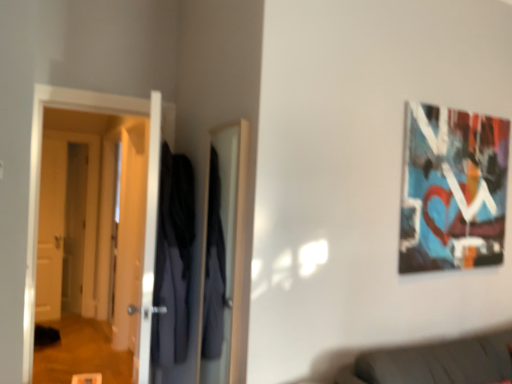
Question: From the image's perspective, relative to white wooden door at left, which is the third door in front-to-back order, is white glossy door at left, acting as the 3th door starting from the back, above or below?

Choices:
 (A) above
 (B) below

Answer: (A)

Question: Is white glossy door at left, acting as the 3th door starting from the back, inside or outside of white wooden door at left, which is the second door from right to left?

Choices:
 (A) outside
 (B) inside

Answer: (A)

Question: Which is farther from the white glossy door at left, marked as the 3th door in a left-to-right arrangement?

Choices:
 (A) dark blue fabric robe at center
 (B) wooden door at left, acting as the 3th door starting from the right
 (C) white wooden door at left, the 1th door in the back-to-front sequence
 (D) matte canvas painting at upper right

Answer: (B)

Question: Which object is the farthest from the matte canvas painting at upper right?

Choices:
 (A) wooden door at left, the 1th door in the left-to-right sequence
 (B) white wooden door at left, the 1th door in the back-to-front sequence
 (C) dark blue fabric robe at center
 (D) white glossy door at left, marked as the 3th door in a left-to-right arrangement

Answer: (A)